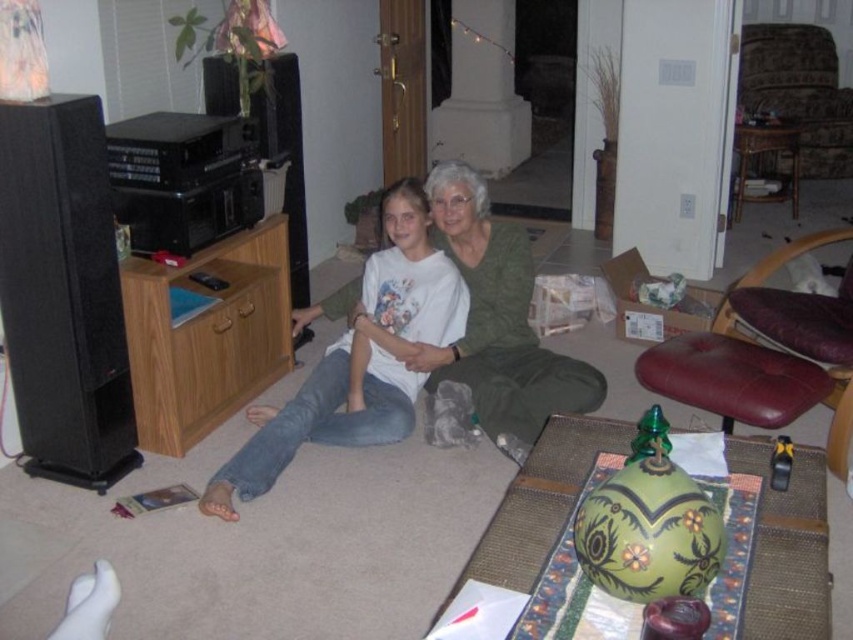
Question: Which object is farther from the camera taking this photo?

Choices:
 (A) white cotton shirt at center
 (B) maroon leather armchair at center-right
 (C) patterned fabric ottoman at upper right
 (D) green textured sweater at center

Answer: (C)

Question: Does white cotton shirt at center appear on the left side of patterned fabric ottoman at upper right?

Choices:
 (A) yes
 (B) no

Answer: (A)

Question: Estimate the real-world distances between objects in this image. Which object is closer to the white cotton shirt at center?

Choices:
 (A) patterned fabric ottoman at upper right
 (B) green textured sweater at center

Answer: (B)

Question: Is maroon leather armchair at center-right positioned in front of patterned fabric ottoman at upper right?

Choices:
 (A) yes
 (B) no

Answer: (A)

Question: Can you confirm if white cotton shirt at center is positioned above maroon leather armchair at center-right?

Choices:
 (A) no
 (B) yes

Answer: (A)

Question: Which point is farther to the camera?

Choices:
 (A) white cotton shirt at center
 (B) green textured sweater at center
 (C) patterned fabric ottoman at upper right
 (D) maroon leather armchair at center-right

Answer: (C)